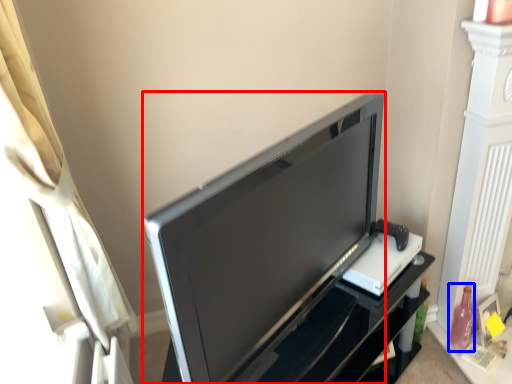
Question: Which point is closer to the camera, television (highlighted by a red box) or bottle (highlighted by a blue box)?

Choices:
 (A) television
 (B) bottle

Answer: (A)